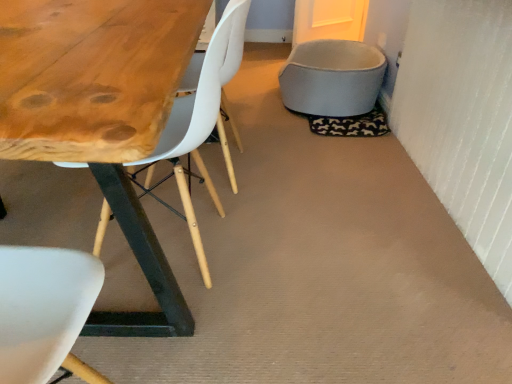
At what (x,y) coordinates should I click in order to perform the action: click on free spot in front of white matte chair at center. Please return your answer as a coordinate pair (x, y). Looking at the image, I should click on (244, 208).